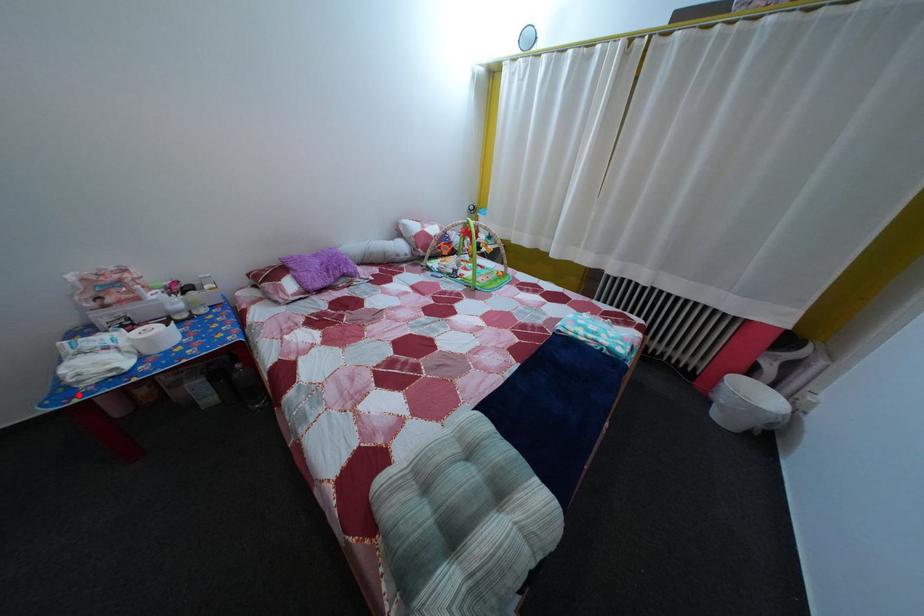
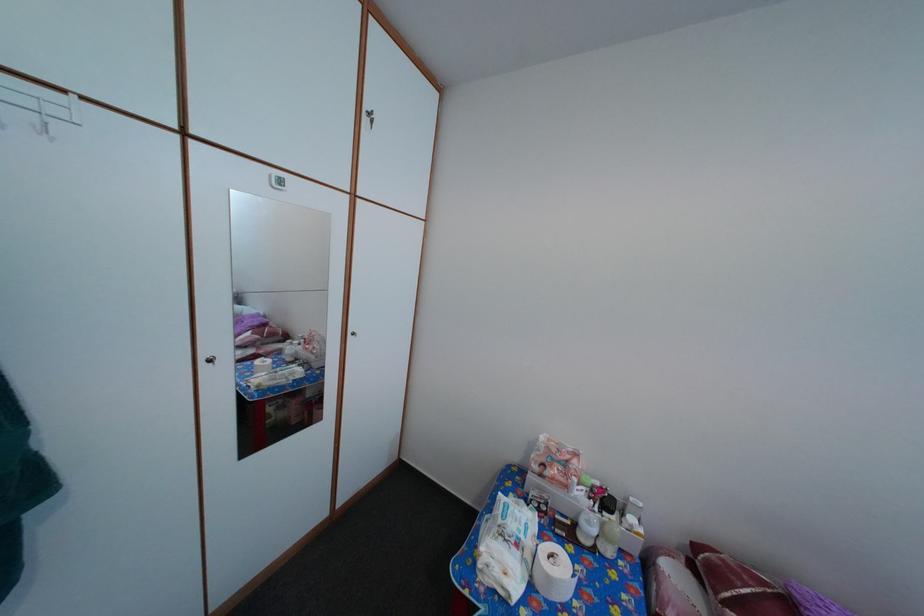
Where in the second image is the point corresponding to the highlighted location from the first image?

(484, 572)